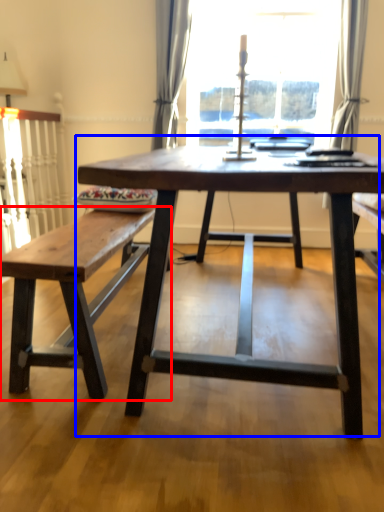
Question: Which object appears farthest to the camera in this image, table (highlighted by a red box) or coffee table (highlighted by a blue box)?

Choices:
 (A) table
 (B) coffee table

Answer: (A)